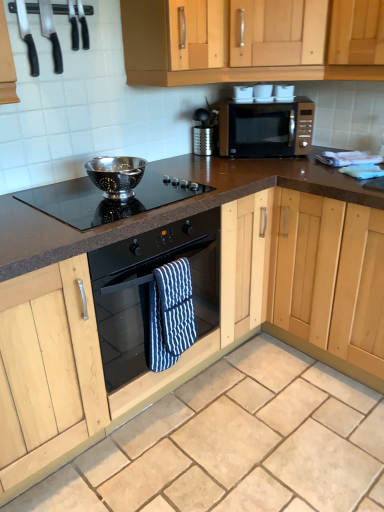
The height and width of the screenshot is (512, 384). Find the location of `vacant region above matte black oven at center, which is counted as the second cabinetry, starting from the top (from a real-world perspective)`. vacant region above matte black oven at center, which is counted as the second cabinetry, starting from the top (from a real-world perspective) is located at coordinates [x=81, y=201].